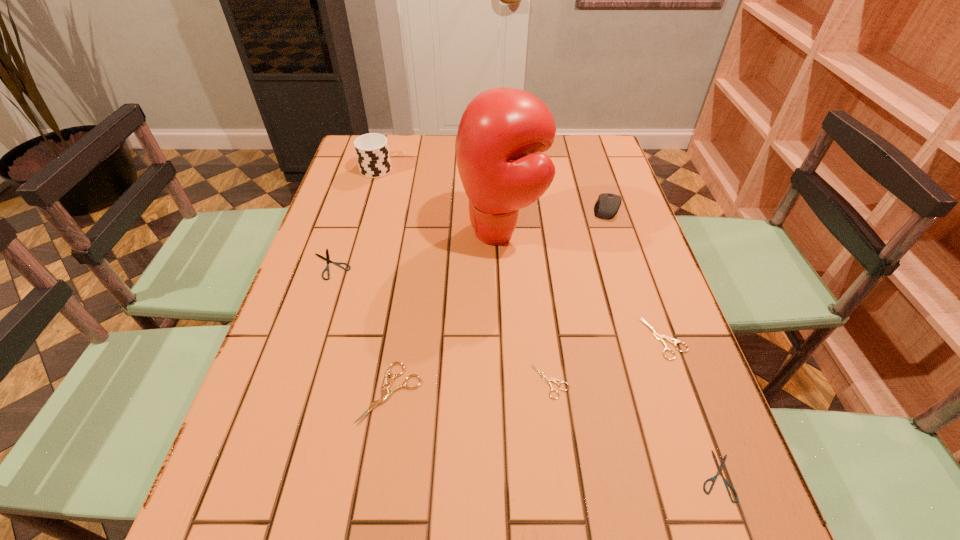
Locate an element on the screen. This screenshot has height=540, width=960. vacant position located 0.050m on the side of the black cup with the handle is located at coordinates (382, 148).

Locate an element on the screen. free space located on the side of the black cup with the handle is located at coordinates (385, 140).

The image size is (960, 540). Find the location of `vacant space situated 0.210m on the back of the black computer equipment`. vacant space situated 0.210m on the back of the black computer equipment is located at coordinates (591, 160).

What are the coordinates of `free spot located on the right of the biggest beige shears` in the screenshot? It's located at (510, 393).

The image size is (960, 540). In order to click on free space located on the back of the second tallest shears in this screenshot , I will do `click(645, 286)`.

Where is `vacant area situated on the front of the second beige shears from left to right`? The width and height of the screenshot is (960, 540). vacant area situated on the front of the second beige shears from left to right is located at coordinates (561, 467).

Locate an element on the screen. vacant space located on the back of the farther black shears is located at coordinates (351, 204).

This screenshot has width=960, height=540. I want to click on free location located on the back of the smaller black shears, so click(693, 409).

Where is `object located in the far edge section of the desktop`? object located in the far edge section of the desktop is located at coordinates (372, 151).

Where is `cup at the left edge`? This screenshot has height=540, width=960. cup at the left edge is located at coordinates (372, 151).